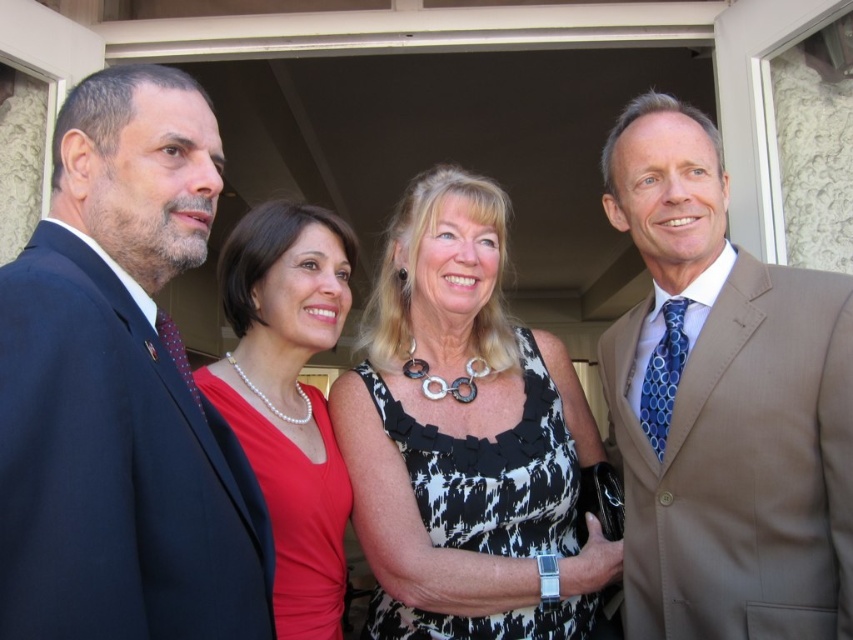
Question: Which point appears farthest from the camera in this image?

Choices:
 (A) coord(50,589)
 (B) coord(412,515)
 (C) coord(695,376)

Answer: (B)

Question: Which object is positioned farthest from the pearl necklace at center?

Choices:
 (A) light brown suit at right
 (B) dark blue suit at left
 (C) black and white printed dress at center

Answer: (A)

Question: Which point is farther from the camera taking this photo?

Choices:
 (A) (339, 573)
 (B) (718, 492)
 (C) (146, 440)

Answer: (A)

Question: Is light brown suit at right to the left of black and white printed dress at center from the viewer's perspective?

Choices:
 (A) yes
 (B) no

Answer: (B)

Question: Considering the relative positions of light brown suit at right and pearl necklace at center in the image provided, where is light brown suit at right located with respect to pearl necklace at center?

Choices:
 (A) left
 (B) right

Answer: (B)

Question: Can you confirm if black and white printed dress at center is thinner than pearl necklace at center?

Choices:
 (A) no
 (B) yes

Answer: (A)